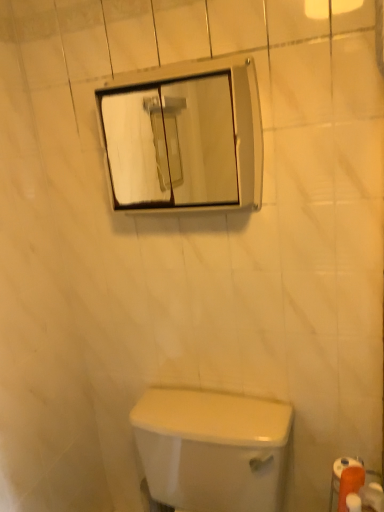
Question: Does clear glass mirror at upper center have a greater width compared to orange matte toilet paper at lower right, positioned as the 2th toilet paper in left-to-right order?

Choices:
 (A) yes
 (B) no

Answer: (A)

Question: Are clear glass mirror at upper center and orange matte toilet paper at lower right, positioned as the 2th toilet paper in left-to-right order, located far from each other?

Choices:
 (A) yes
 (B) no

Answer: (A)

Question: Does clear glass mirror at upper center come in front of orange matte toilet paper at lower right, which is counted as the 2th toilet paper, starting from the right?

Choices:
 (A) yes
 (B) no

Answer: (A)

Question: Is orange matte toilet paper at lower right, positioned as the 2th toilet paper in left-to-right order, a part of clear glass mirror at upper center?

Choices:
 (A) no
 (B) yes

Answer: (A)

Question: From a real-world perspective, does clear glass mirror at upper center stand above orange matte toilet paper at lower right, positioned as the 2th toilet paper in left-to-right order?

Choices:
 (A) yes
 (B) no

Answer: (A)

Question: From the image's perspective, would you say clear glass mirror at upper center is shown under orange matte toilet paper at lower right, which is counted as the 2th toilet paper, starting from the right?

Choices:
 (A) no
 (B) yes

Answer: (A)

Question: Can you confirm if white matte toilet paper at lower right, positioned as the 3th toilet paper in right-to-left order, is wider than white glossy toilet at lower center?

Choices:
 (A) yes
 (B) no

Answer: (B)

Question: From a real-world perspective, is white matte toilet paper at lower right, positioned as the 3th toilet paper in right-to-left order, under white glossy toilet at lower center?

Choices:
 (A) no
 (B) yes

Answer: (A)

Question: Does white matte toilet paper at lower right, positioned as the 3th toilet paper in right-to-left order, touch white glossy toilet at lower center?

Choices:
 (A) no
 (B) yes

Answer: (A)

Question: Is white matte toilet paper at lower right, positioned as the 3th toilet paper in right-to-left order, oriented towards white glossy toilet at lower center?

Choices:
 (A) yes
 (B) no

Answer: (A)

Question: Is white matte toilet paper at lower right, the 1th toilet paper positioned from the left, far from white glossy toilet at lower center?

Choices:
 (A) yes
 (B) no

Answer: (B)

Question: From a real-world perspective, does white matte toilet paper at lower right, positioned as the 3th toilet paper in right-to-left order, stand above white glossy toilet at lower center?

Choices:
 (A) no
 (B) yes

Answer: (B)

Question: Is white glossy toilet at lower center oriented towards white matte toilet paper at lower right, positioned as the 3th toilet paper in right-to-left order?

Choices:
 (A) yes
 (B) no

Answer: (B)